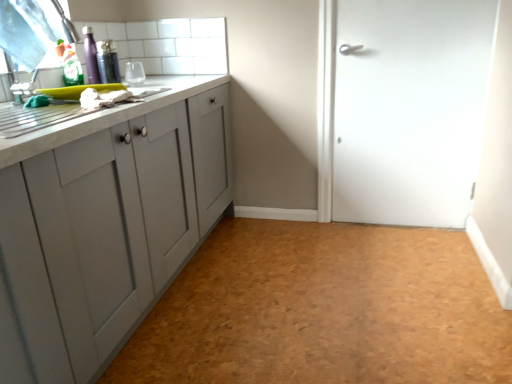
This screenshot has width=512, height=384. Describe the element at coordinates (168, 44) in the screenshot. I see `white tile at upper center` at that location.

This screenshot has height=384, width=512. What do you see at coordinates (29, 30) in the screenshot? I see `transparent plastic window screen at upper left` at bounding box center [29, 30].

The image size is (512, 384). I want to click on cork-textured floor at center, so click(x=323, y=310).

In the scene shown: What is the approximate width of white marble countertop at left?

white marble countertop at left is 18.81 inches wide.

Where is `white tile at upper center`? The width and height of the screenshot is (512, 384). white tile at upper center is located at coordinates (168, 44).

Who is smaller, white matte door at right or cork-textured floor at center?

Smaller between the two is white matte door at right.

Can we say white matte door at right lies outside cork-textured floor at center?

Indeed, white matte door at right is completely outside cork-textured floor at center.

Can you tell me how much white matte door at right and cork-textured floor at center differ in facing direction?

The angular difference between white matte door at right and cork-textured floor at center is 91.1 degrees.

Which is in front, point (345, 112) or point (191, 353)?

Point (191, 353)

Are transparent plastic window screen at upper left and cork-textured floor at center far apart?

Yes, transparent plastic window screen at upper left and cork-textured floor at center are located far from each other.

How far apart are transparent plastic window screen at upper left and cork-textured floor at center?

transparent plastic window screen at upper left and cork-textured floor at center are 1.44 meters apart.

Looking at this image, between transparent plastic window screen at upper left and cork-textured floor at center, which one has less height?

cork-textured floor at center.

Which object is positioned more to the left, transparent plastic window screen at upper left or cork-textured floor at center?

transparent plastic window screen at upper left is more to the left.

Is point (426, 257) farther from camera compared to point (49, 43)?

Yes.

From the image's perspective, is cork-textured floor at center under transparent plastic window screen at upper left?

Yes.

Is cork-textured floor at center facing away from transparent plastic window screen at upper left?

No.

What's the angular difference between cork-textured floor at center and transparent plastic window screen at upper left's facing directions?

The facing directions of cork-textured floor at center and transparent plastic window screen at upper left are 145 degrees apart.

Considering the positions of objects transparent plastic window screen at upper left and white matte door at right in the image provided, who is more to the right, transparent plastic window screen at upper left or white matte door at right?

white matte door at right.

Is transparent plastic window screen at upper left positioned far away from white matte door at right?

Yes, transparent plastic window screen at upper left and white matte door at right are quite far apart.

From a real-world perspective, who is located higher, transparent plastic window screen at upper left or white matte door at right?

transparent plastic window screen at upper left is physically above.

Can you confirm if transparent plastic window screen at upper left is shorter than white matte door at right?

Correct, transparent plastic window screen at upper left is not as tall as white matte door at right.

The width and height of the screenshot is (512, 384). What are the coordinates of `tile lying above the cork-textured floor at center (from the image's perspective)` in the screenshot? It's located at (168, 44).

Does point (187, 61) appear closer or farther from the camera than point (349, 315)?

Point (187, 61) is positioned farther from the camera compared to point (349, 315).

From a real-world perspective, which is physically below, white tile at upper center or cork-textured floor at center?

cork-textured floor at center.

Is white tile at upper center looking in the opposite direction of white matte door at right?

No, white matte door at right is not at the back of white tile at upper center.

Who is more distant, white tile at upper center or white matte door at right?

white tile at upper center is behind.

Locate an element on the screen. Image resolution: width=512 pixels, height=384 pixels. tile behind the white matte door at right is located at coordinates (168, 44).

Locate an element on the screen. This screenshot has width=512, height=384. door directly beneath the white tile at upper center (from a real-world perspective) is located at coordinates pos(409,109).

Can you confirm if white matte door at right is taller than white tile at upper center?

Yes.

From the image's perspective, which is above, white matte door at right or white tile at upper center?

white tile at upper center.

Does point (437, 148) come behind point (205, 50)?

That is False.

The width and height of the screenshot is (512, 384). In order to click on door lying on the right of cork-textured floor at center in this screenshot , I will do `click(409, 109)`.

Where is `window screen that is above the cork-textured floor at center (from the image's perspective)`? This screenshot has width=512, height=384. window screen that is above the cork-textured floor at center (from the image's perspective) is located at coordinates (29, 30).

Looking at the image, which one is located further to cork-textured floor at center, white marble countertop at left or white matte door at right?

white marble countertop at left lies further to cork-textured floor at center than the other object.

Looking at the image, which one is located closer to white marble countertop at left, transparent plastic window screen at upper left or white tile at upper center?

The object closer to white marble countertop at left is white tile at upper center.

Based on their spatial positions, is cork-textured floor at center or transparent plastic window screen at upper left closer to white tile at upper center?

transparent plastic window screen at upper left is closer to white tile at upper center.

Which object lies further to the anchor point cork-textured floor at center, white tile at upper center or white matte door at right?

The object further to cork-textured floor at center is white tile at upper center.

Which object lies nearer to the anchor point cork-textured floor at center, white tile at upper center or white marble countertop at left?

white marble countertop at left is positioned closer to the anchor cork-textured floor at center.

From the image, which object appears to be nearer to transparent plastic window screen at upper left, white marble countertop at left or white tile at upper center?

white marble countertop at left lies closer to transparent plastic window screen at upper left than the other object.

Estimate the real-world distances between objects in this image. Which object is further from white marble countertop at left, white tile at upper center or white matte door at right?

white matte door at right lies further to white marble countertop at left than the other object.

When comparing their distances from white tile at upper center, does transparent plastic window screen at upper left or cork-textured floor at center seem further?

cork-textured floor at center is positioned further to the anchor white tile at upper center.

Find the location of a particular element. The width and height of the screenshot is (512, 384). window screen positioned between white marble countertop at left and white tile at upper center from near to far is located at coordinates (29, 30).

Where is `window screen between white tile at upper center and cork-textured floor at center vertically`? The image size is (512, 384). window screen between white tile at upper center and cork-textured floor at center vertically is located at coordinates (29, 30).

At what (x,y) coordinates should I click in order to perform the action: click on tile between white marble countertop at left and white matte door at right from left to right. Please return your answer as a coordinate pair (x, y). Looking at the image, I should click on (168, 44).

This screenshot has height=384, width=512. What are the coordinates of `tile between transparent plastic window screen at upper left and white matte door at right` in the screenshot? It's located at (168, 44).